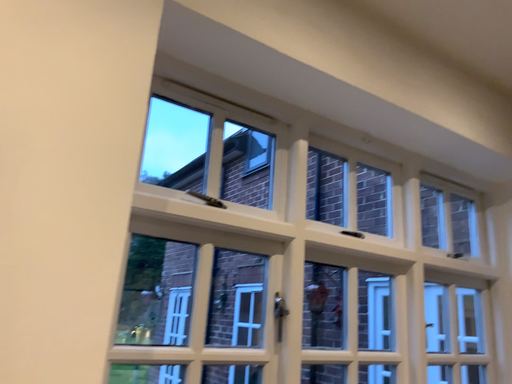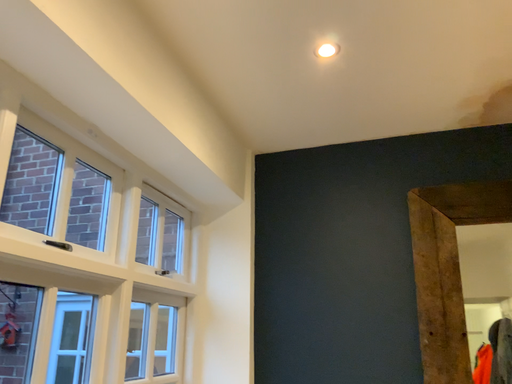
Question: How did the camera likely rotate when shooting the video?

Choices:
 (A) rotated left
 (B) rotated right

Answer: (B)